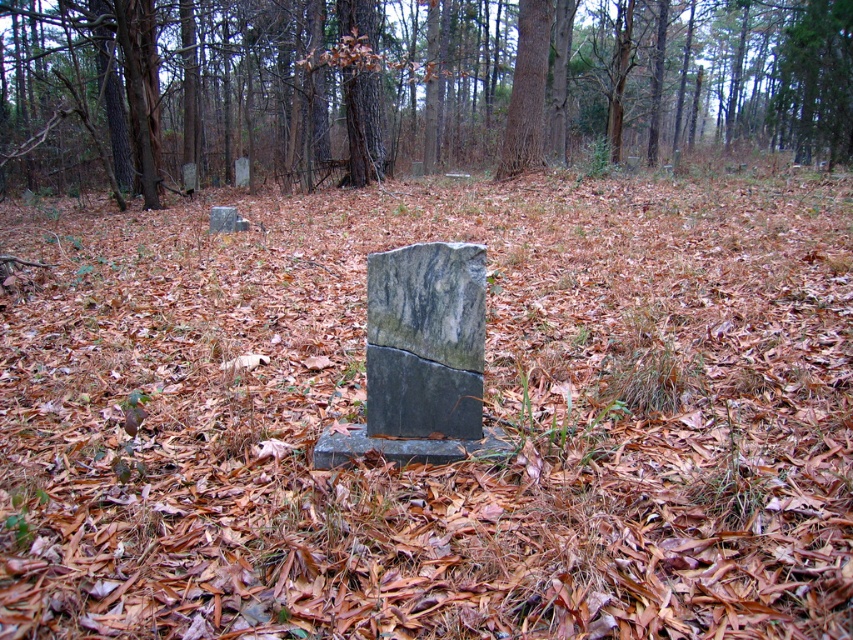
Does smooth gray stone at center have a smaller size compared to marble gravestone at center?

No, smooth gray stone at center is not smaller than marble gravestone at center.

Between smooth gray stone at center and marble gravestone at center, which one has less height?

Standing shorter between the two is marble gravestone at center.

Which is in front, point (509, 150) or point (433, 348)?

Positioned in front is point (433, 348).

Image resolution: width=853 pixels, height=640 pixels. I want to click on smooth gray stone at center, so click(409, 88).

Does marble gravestone at center appear over smooth brown bark at center?

Incorrect, marble gravestone at center is not positioned above smooth brown bark at center.

Between marble gravestone at center and smooth brown bark at center, which one appears on the left side from the viewer's perspective?

Positioned to the left is marble gravestone at center.

Which is behind, point (469, 410) or point (509, 108)?

The point (509, 108) is more distant.

The image size is (853, 640). In order to click on marble gravestone at center in this screenshot , I will do `click(425, 340)`.

Between point (102, 83) and point (517, 120), which one is positioned in front?

Positioned in front is point (517, 120).

Is point (177, 104) closer to camera compared to point (534, 17)?

No, (177, 104) is further to viewer.

Image resolution: width=853 pixels, height=640 pixels. In order to click on smooth gray stone at center in this screenshot , I will do `click(409, 88)`.